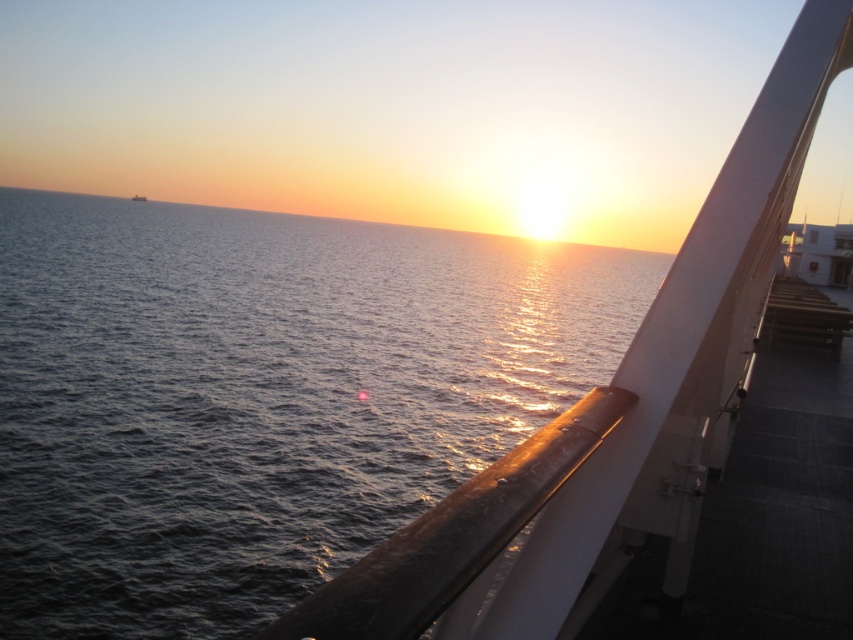
Does dark blue water at center have a greater width compared to smooth white railing at upper right?

Correct, the width of dark blue water at center exceeds that of smooth white railing at upper right.

Which of these two, dark blue water at center or smooth white railing at upper right, stands shorter?

Standing shorter between the two is smooth white railing at upper right.

Where is `dark blue water at center`? The image size is (853, 640). dark blue water at center is located at coordinates (260, 397).